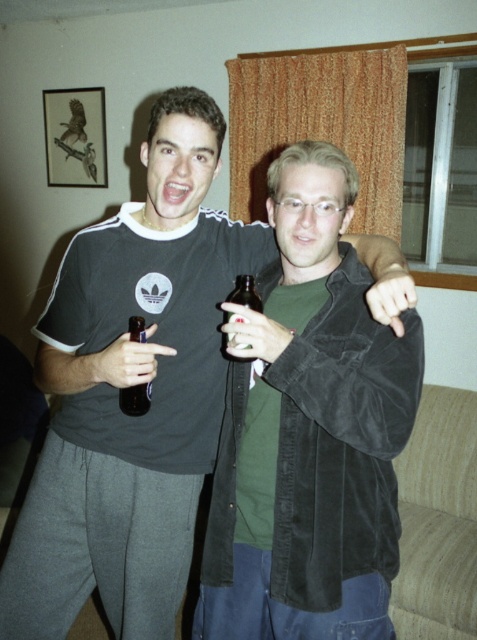
Consider the image. Does matte plastic bottle at center appear over brown glass bottle at center?

Incorrect, matte plastic bottle at center is not positioned above brown glass bottle at center.

Measure the distance between matte plastic bottle at center and camera.

matte plastic bottle at center and camera are 1.21 meters apart from each other.

Find the location of `matte plastic bottle at center`. matte plastic bottle at center is located at coordinates (134, 400).

Describe the element at coordinates (309, 432) in the screenshot. I see `velvet black jacket at center` at that location.

Can you confirm if velvet black jacket at center is positioned to the right of brown glass bottle at center?

Yes, velvet black jacket at center is to the right of brown glass bottle at center.

Which is behind, point (319, 260) or point (225, 314)?

Point (225, 314)

This screenshot has width=477, height=640. What are the coordinates of `velvet black jacket at center` in the screenshot? It's located at (309, 432).

Between velvet black jacket at center and matte plastic bottle at center, which one has less height?

Standing shorter between the two is matte plastic bottle at center.

Is point (383, 470) closer to viewer compared to point (123, 392)?

Yes, it is.

Is point (302, 424) positioned after point (145, 396)?

No, it is not.

Identify the location of velvet black jacket at center. (309, 432).